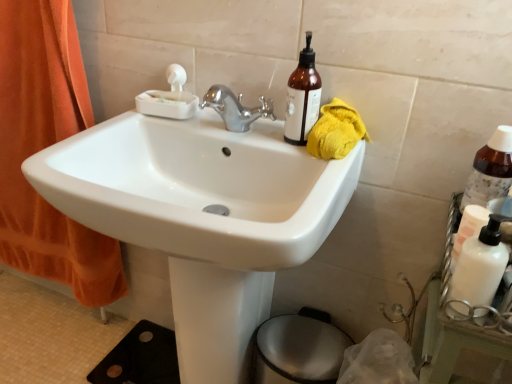
Question: Is translucent amber bottle at upper right, the first bottle in the top-to-bottom sequence, closer to camera compared to metallic silver bidet at lower center?

Choices:
 (A) no
 (B) yes

Answer: (B)

Question: Does translucent amber bottle at upper right, the first bottle in the top-to-bottom sequence, have a smaller size compared to metallic silver bidet at lower center?

Choices:
 (A) no
 (B) yes

Answer: (B)

Question: Considering the relative sizes of translucent amber bottle at upper right, the first bottle in the top-to-bottom sequence, and metallic silver bidet at lower center in the image provided, is translucent amber bottle at upper right, the first bottle in the top-to-bottom sequence, shorter than metallic silver bidet at lower center?

Choices:
 (A) no
 (B) yes

Answer: (B)

Question: Does translucent amber bottle at upper right, marked as the 1th bottle in a left-to-right arrangement, have a lesser width compared to metallic silver bidet at lower center?

Choices:
 (A) no
 (B) yes

Answer: (B)

Question: Is the depth of translucent amber bottle at upper right, the second bottle positioned from the right, greater than that of metallic silver bidet at lower center?

Choices:
 (A) yes
 (B) no

Answer: (B)

Question: Is metallic silver bidet at lower center surrounded by translucent amber bottle at upper right, the second bottle from the bottom?

Choices:
 (A) no
 (B) yes

Answer: (A)

Question: Is white glossy sink at center closer to camera compared to yellow cloth at upper right?

Choices:
 (A) yes
 (B) no

Answer: (A)

Question: Is yellow cloth at upper right at the back of white glossy sink at center?

Choices:
 (A) yes
 (B) no

Answer: (B)

Question: From a real-world perspective, is white glossy sink at center on top of yellow cloth at upper right?

Choices:
 (A) no
 (B) yes

Answer: (A)

Question: Does white glossy sink at center turn towards yellow cloth at upper right?

Choices:
 (A) yes
 (B) no

Answer: (B)

Question: From a real-world perspective, is white glossy sink at center below yellow cloth at upper right?

Choices:
 (A) yes
 (B) no

Answer: (A)

Question: Does white glossy sink at center have a lesser height compared to yellow cloth at upper right?

Choices:
 (A) no
 (B) yes

Answer: (A)

Question: Can you confirm if yellow cloth at upper right is smaller than translucent amber bottle at upper right, the second bottle from the bottom?

Choices:
 (A) no
 (B) yes

Answer: (A)